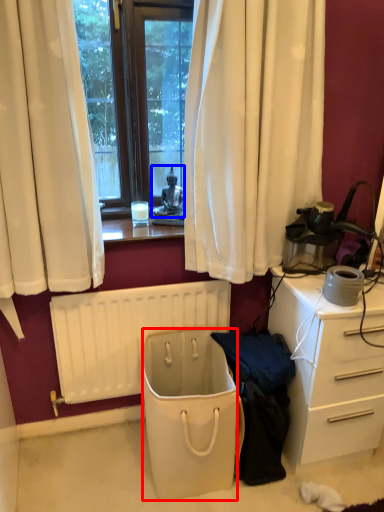
Question: Which object is closer to the camera taking this photo, trash bin/can (highlighted by a red box) or person (highlighted by a blue box)?

Choices:
 (A) trash bin/can
 (B) person

Answer: (A)